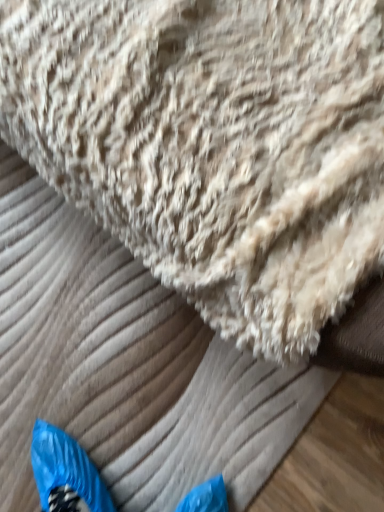
What is the approximate width of beige fluffy towel at upper center?

The width of beige fluffy towel at upper center is 17.25 inches.

Describe the element at coordinates (214, 145) in the screenshot. The width and height of the screenshot is (384, 512). I see `beige fluffy towel at upper center` at that location.

This screenshot has width=384, height=512. Find the location of `beige fluffy towel at upper center`. beige fluffy towel at upper center is located at coordinates (214, 145).

Describe the element at coordinates (126, 366) in the screenshot. I see `beige fluffy blanket at upper center` at that location.

Measure the distance between point (22, 181) and camera.

A distance of 1.01 meters exists between point (22, 181) and camera.

At what (x,y) coordinates should I click in order to perform the action: click on beige fluffy blanket at upper center. Please return your answer as a coordinate pair (x, y). The height and width of the screenshot is (512, 384). Looking at the image, I should click on (126, 366).

The height and width of the screenshot is (512, 384). Find the location of `beige fluffy towel at upper center`. beige fluffy towel at upper center is located at coordinates (214, 145).

Does beige fluffy towel at upper center appear on the right side of beige fluffy blanket at upper center?

Yes.

From the picture: Which object is closer to the camera taking this photo, beige fluffy towel at upper center or beige fluffy blanket at upper center?

beige fluffy towel at upper center.

Is point (108, 71) closer to viewer compared to point (119, 315)?

Yes, it is in front of point (119, 315).

From the image's perspective, between beige fluffy towel at upper center and beige fluffy blanket at upper center, which one is located above?

beige fluffy towel at upper center, from the image's perspective.

From a real-world perspective, between beige fluffy towel at upper center and beige fluffy blanket at upper center, who is vertically lower?

beige fluffy blanket at upper center, from a real-world perspective.

Looking at their sizes, would you say beige fluffy towel at upper center is wider or thinner than beige fluffy blanket at upper center?

Clearly, beige fluffy towel at upper center has less width compared to beige fluffy blanket at upper center.

Considering the relative sizes of beige fluffy towel at upper center and beige fluffy blanket at upper center in the image provided, is beige fluffy towel at upper center shorter than beige fluffy blanket at upper center?

Incorrect, the height of beige fluffy towel at upper center does not fall short of that of beige fluffy blanket at upper center.

Between beige fluffy towel at upper center and beige fluffy blanket at upper center, which one has smaller size?

Smaller between the two is beige fluffy blanket at upper center.

Could beige fluffy blanket at upper center be considered to be inside beige fluffy towel at upper center?

No.

Is beige fluffy towel at upper center directly adjacent to beige fluffy blanket at upper center?

No, beige fluffy towel at upper center is not next to beige fluffy blanket at upper center.

Is beige fluffy towel at upper center oriented towards beige fluffy blanket at upper center?

Yes.

This screenshot has height=512, width=384. What are the coordinates of `towel lying in front of the beige fluffy blanket at upper center` in the screenshot? It's located at (214, 145).

Is beige fluffy blanket at upper center to the left or to the right of beige fluffy towel at upper center in the image?

Based on their positions, beige fluffy blanket at upper center is located to the left of beige fluffy towel at upper center.

In the image, is beige fluffy blanket at upper center positioned in front of or behind beige fluffy towel at upper center?

In the image, beige fluffy blanket at upper center appears behind beige fluffy towel at upper center.

Considering the positions of point (5, 395) and point (157, 8), is point (5, 395) closer or farther from the camera than point (157, 8)?

Point (5, 395) is farther from the camera than point (157, 8).

From the image's perspective, which one is positioned lower, beige fluffy blanket at upper center or beige fluffy towel at upper center?

beige fluffy blanket at upper center is shown below in the image.

From a real-world perspective, between beige fluffy blanket at upper center and beige fluffy towel at upper center, who is vertically lower?

In real-world perspective, beige fluffy blanket at upper center is lower.

Is beige fluffy blanket at upper center thinner than beige fluffy towel at upper center?

Incorrect, the width of beige fluffy blanket at upper center is not less than that of beige fluffy towel at upper center.

Considering the sizes of objects beige fluffy blanket at upper center and beige fluffy towel at upper center in the image provided, who is taller, beige fluffy blanket at upper center or beige fluffy towel at upper center?

Standing taller between the two is beige fluffy towel at upper center.

Considering the sizes of objects beige fluffy blanket at upper center and beige fluffy towel at upper center in the image provided, who is smaller, beige fluffy blanket at upper center or beige fluffy towel at upper center?

With smaller size is beige fluffy blanket at upper center.

Do you think beige fluffy blanket at upper center is within beige fluffy towel at upper center, or outside of it?

beige fluffy blanket at upper center is not inside beige fluffy towel at upper center, it's outside.

Is the surface of beige fluffy blanket at upper center in direct contact with beige fluffy towel at upper center?

beige fluffy blanket at upper center and beige fluffy towel at upper center are not in contact.

Could you tell me if beige fluffy blanket at upper center is turned towards beige fluffy towel at upper center?

No, beige fluffy blanket at upper center is not aimed at beige fluffy towel at upper center.

This screenshot has height=512, width=384. Find the location of `sheet on the left side of beige fluffy towel at upper center`. sheet on the left side of beige fluffy towel at upper center is located at coordinates (126, 366).

Where is `towel lying on the right of beige fluffy blanket at upper center`? towel lying on the right of beige fluffy blanket at upper center is located at coordinates (214, 145).

What are the coordinates of `towel in front of the beige fluffy blanket at upper center` in the screenshot? It's located at (214, 145).